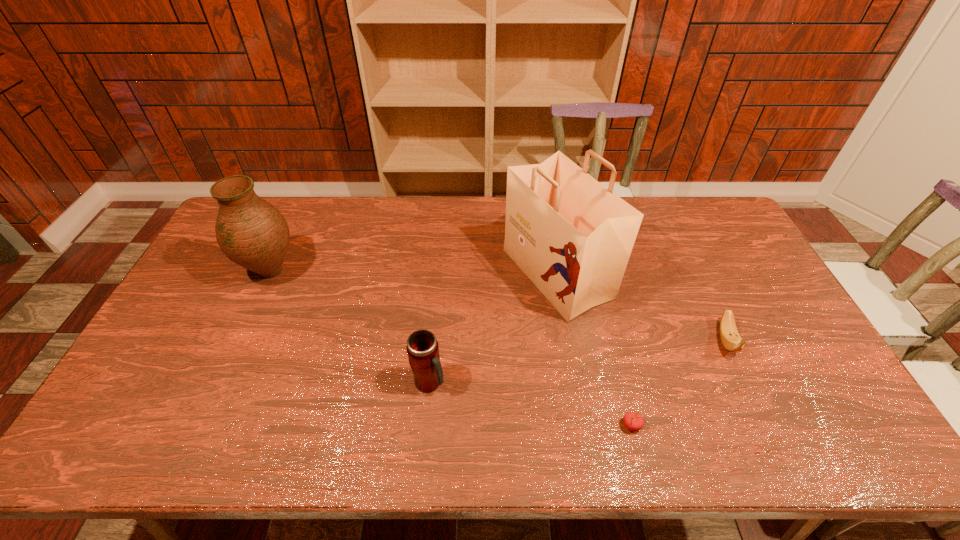
Locate an element on the screen. This screenshot has width=960, height=540. vacant area located 0.260m on the right of the leftmost object is located at coordinates (381, 272).

Find the location of a particular element. vacant area situated on the side with the handle of the third shortest object is located at coordinates (534, 383).

Locate an element on the screen. Image resolution: width=960 pixels, height=540 pixels. vacant region located 0.180m on the front of the rightmost object is located at coordinates (766, 425).

Where is `vacant space located 0.060m on the left of the nearest object`? vacant space located 0.060m on the left of the nearest object is located at coordinates (597, 426).

The image size is (960, 540). What are the coordinates of `object present at the far edge` in the screenshot? It's located at (572, 237).

This screenshot has width=960, height=540. In order to click on object positioned at the near edge in this screenshot , I will do `click(633, 421)`.

Identify the location of object situated at the left edge. Image resolution: width=960 pixels, height=540 pixels. (251, 232).

In the image, there is a desktop. In order to click on vacant area at the far edge in this screenshot , I will do (380, 208).

You are a GUI agent. You are given a task and a screenshot of the screen. Output one action in this format:
    pyautogui.click(x=<x>, y=<y>)
    Task: Click on the free space at the left edge of the desktop
    This screenshot has height=540, width=960.
    Given the screenshot: What is the action you would take?
    pyautogui.click(x=219, y=259)

Find the location of `free location at the right edge`. free location at the right edge is located at coordinates (799, 364).